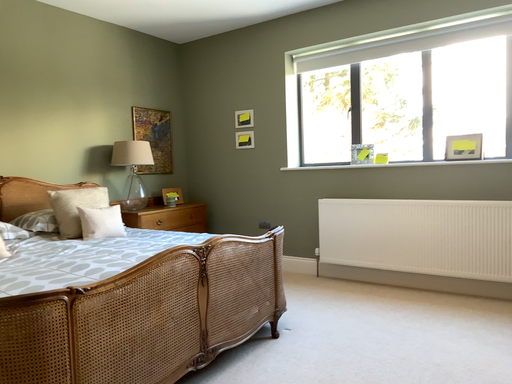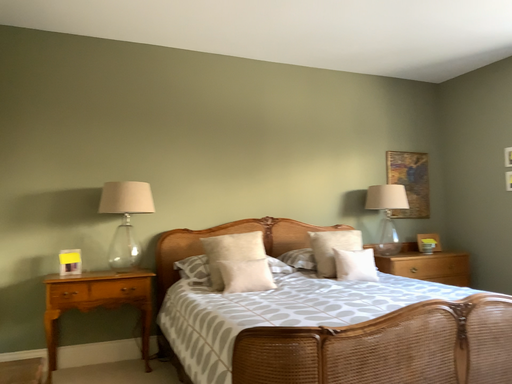
Question: How did the camera likely rotate when shooting the video?

Choices:
 (A) rotated upward
 (B) rotated downward

Answer: (A)